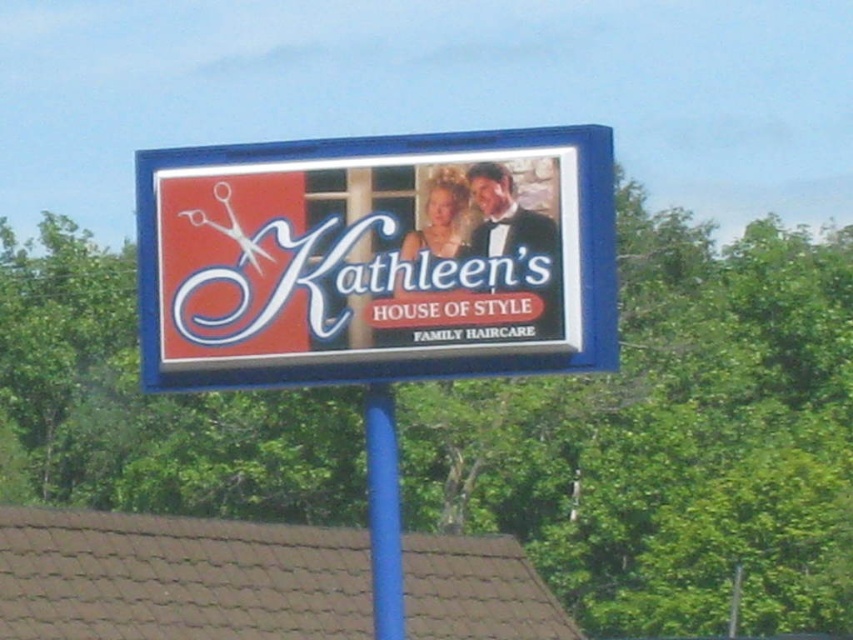
You are standing in front of the billboard for Kathleen House of Style. You want to touch the matte plastic sign at center. Where should you reach to touch it?

The matte plastic sign at center is located at the 2D coordinates point (373, 259), so you should reach to that point to touch it.

Consider the image. You are standing in front of the billboard for Kathleen House of Style. You see the matte plastic sign at center and the blue plastic pole at center. Which object is closer to your right side?

The matte plastic sign at center is to the right of the blue plastic pole at center, so it is closer to your right side.